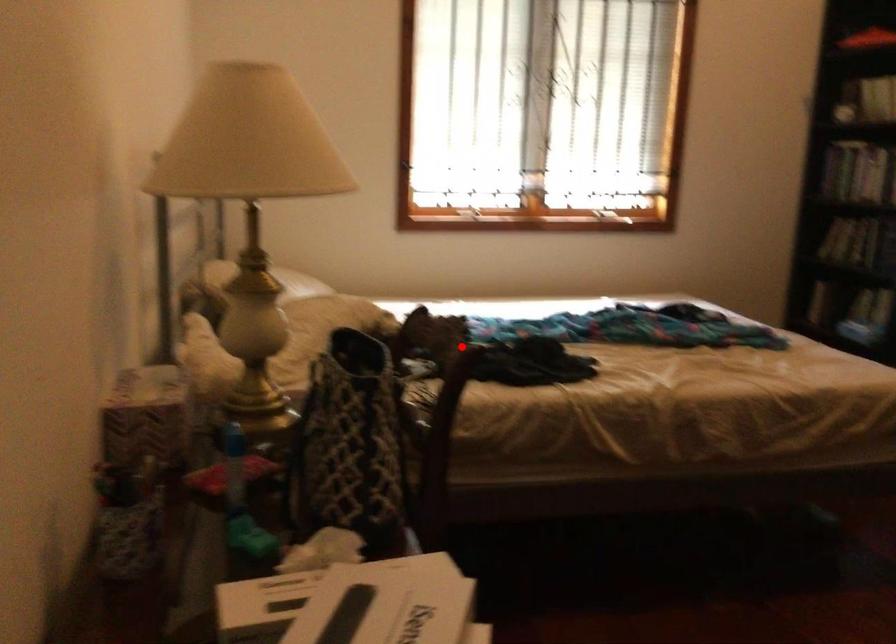
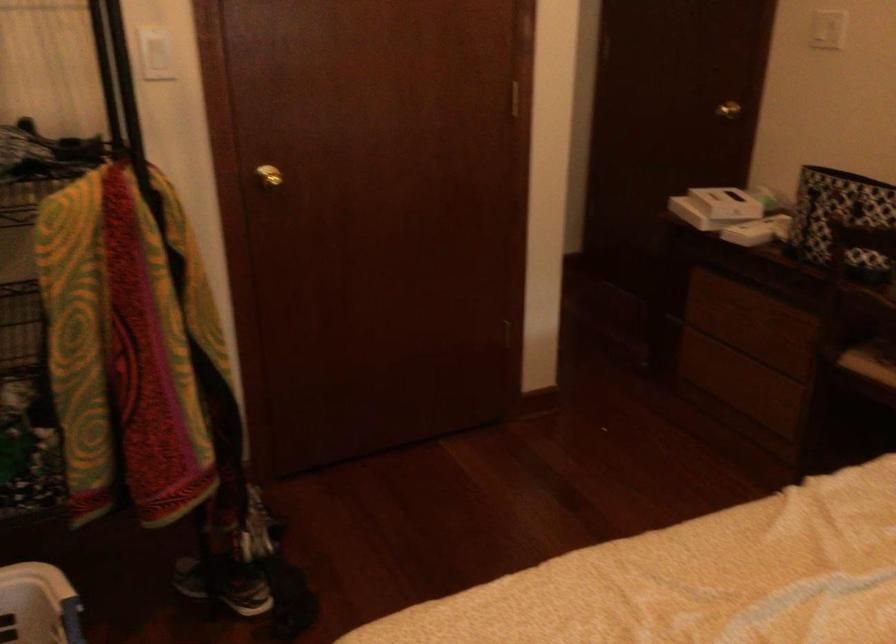
Question: I am providing you with two images of the same scene from different viewpoints. Given a red point in image1, look at the same physical point in image2. Is it:

Choices:
 (A) Closer to the viewpoint
 (B) Farther from the viewpoint

Answer: (B)